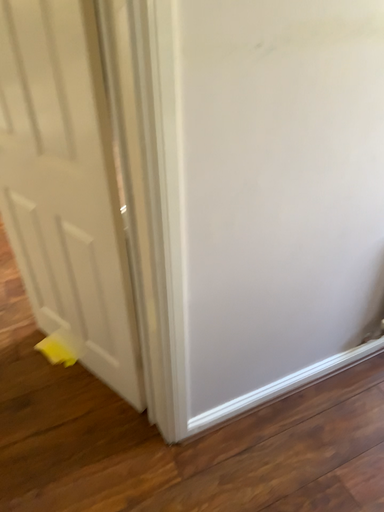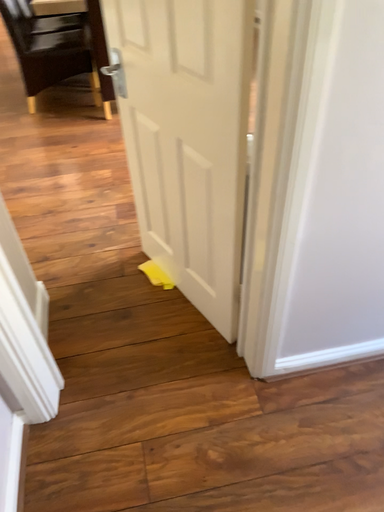
Question: Which way did the camera rotate in the video?

Choices:
 (A) rotated right
 (B) rotated left

Answer: (B)